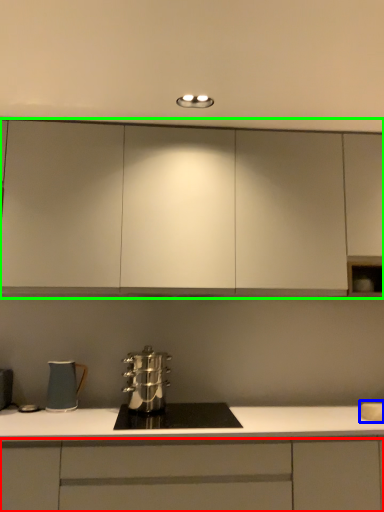
Question: Estimate the real-world distances between objects in this image. Which object is closer to cabinetry (highlighted by a red box), sink (highlighted by a blue box) or cabinetry (highlighted by a green box)?

Choices:
 (A) sink
 (B) cabinetry

Answer: (A)